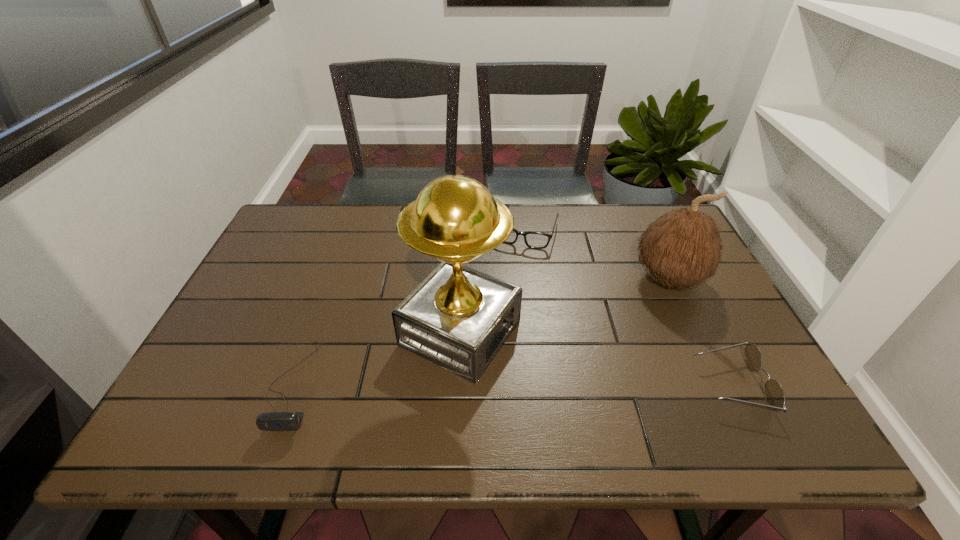
This screenshot has height=540, width=960. Find the location of `spectacles situated at the near edge`. spectacles situated at the near edge is located at coordinates (774, 394).

Locate an element on the screen. The image size is (960, 540). award present at the near edge is located at coordinates (458, 318).

You are a GUI agent. You are given a task and a screenshot of the screen. Output one action in this format:
    pyautogui.click(x=<x>, y=<y>)
    Task: Click on the spectacles that is at the right edge
    This screenshot has height=540, width=960.
    Given the screenshot: What is the action you would take?
    [774, 394]

Where is `coconut situated at the right edge`? coconut situated at the right edge is located at coordinates (683, 248).

The height and width of the screenshot is (540, 960). I want to click on object positioned at the near right corner, so click(774, 394).

At what (x,y) coordinates should I click in order to perform the action: click on vacant space at the far edge of the desktop. Please return your answer as a coordinate pair (x, y). This screenshot has width=960, height=540. Looking at the image, I should click on (613, 215).

At what (x,y) coordinates should I click in order to perform the action: click on vacant space at the near edge of the desktop. Please return your answer as a coordinate pair (x, y). This screenshot has height=540, width=960. Looking at the image, I should click on (684, 374).

The height and width of the screenshot is (540, 960). I want to click on vacant space at the left edge of the desktop, so click(247, 343).

In the image, there is a desktop. Where is `vacant space at the far left corner`? vacant space at the far left corner is located at coordinates (316, 209).

Find the location of a particular element. The width and height of the screenshot is (960, 540). vacant space at the near left corner of the desktop is located at coordinates (221, 374).